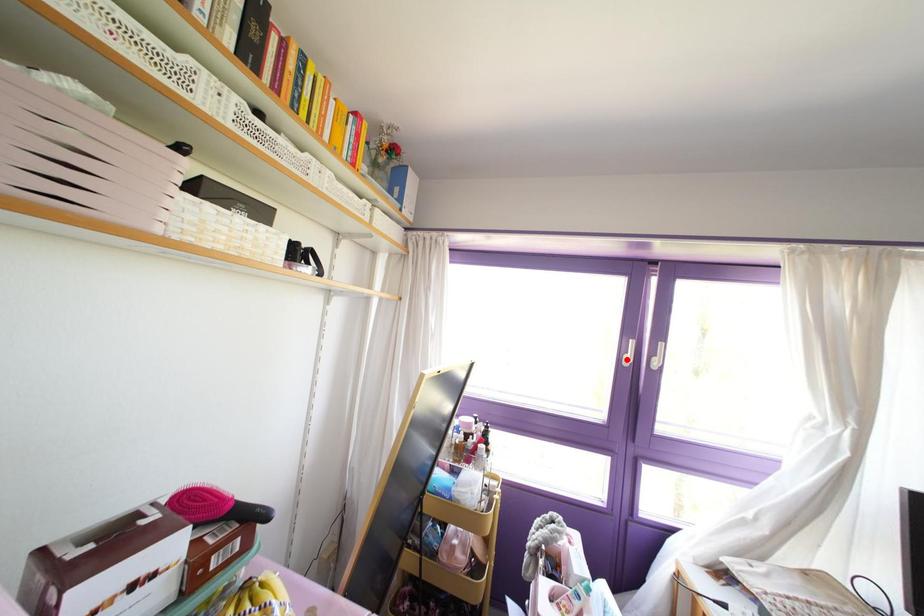
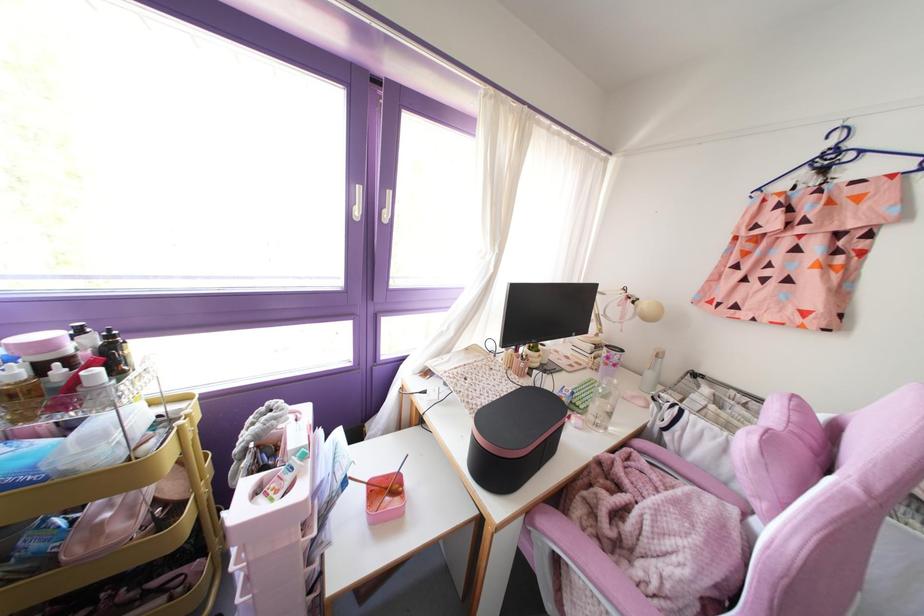
In the second image, find the point that corresponds to the highlighted location in the first image.

(357, 212)